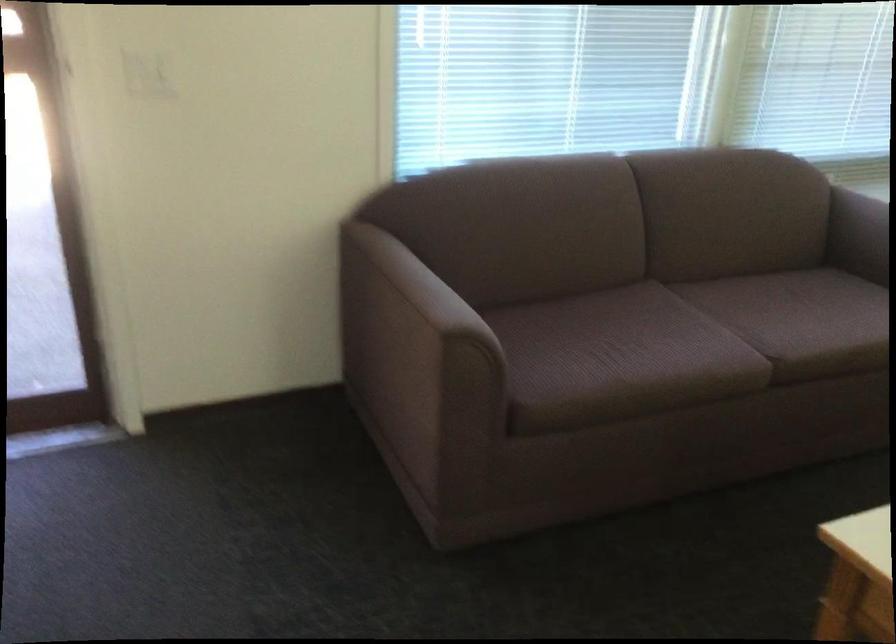
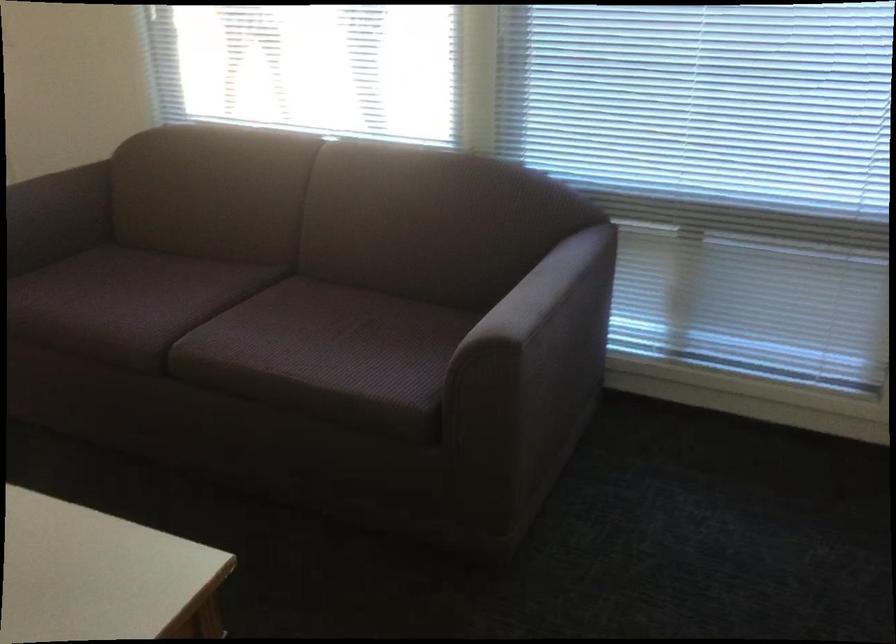
Find the pixel in the second image that matches (x=816, y=317) in the first image.

(325, 346)